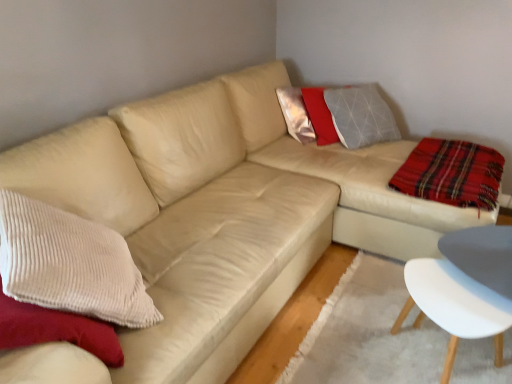
Question: Does white plastic chair at lower right have a smaller size compared to plaid fabric at right?

Choices:
 (A) yes
 (B) no

Answer: (B)

Question: Could plaid fabric at right be considered to be inside white plastic chair at lower right?

Choices:
 (A) yes
 (B) no

Answer: (B)

Question: Is white plastic chair at lower right positioned behind plaid fabric at right?

Choices:
 (A) yes
 (B) no

Answer: (B)

Question: Does white plastic chair at lower right turn towards plaid fabric at right?

Choices:
 (A) no
 (B) yes

Answer: (A)

Question: Is white plastic chair at lower right looking in the opposite direction of plaid fabric at right?

Choices:
 (A) no
 (B) yes

Answer: (A)

Question: From a real-world perspective, is white plastic chair at lower right below plaid fabric at right?

Choices:
 (A) yes
 (B) no

Answer: (A)

Question: Does plaid fabric at right have a lesser width compared to white plastic chair at lower right?

Choices:
 (A) yes
 (B) no

Answer: (B)

Question: Can you confirm if plaid fabric at right is positioned to the left of white plastic chair at lower right?

Choices:
 (A) yes
 (B) no

Answer: (B)

Question: Is plaid fabric at right touching white plastic chair at lower right?

Choices:
 (A) no
 (B) yes

Answer: (A)

Question: Does plaid fabric at right come in front of white plastic chair at lower right?

Choices:
 (A) yes
 (B) no

Answer: (B)

Question: Does plaid fabric at right come behind white plastic chair at lower right?

Choices:
 (A) no
 (B) yes

Answer: (B)

Question: Does plaid fabric at right turn towards white plastic chair at lower right?

Choices:
 (A) no
 (B) yes

Answer: (A)

Question: Is point (408, 289) positioned closer to the camera than point (481, 175)?

Choices:
 (A) closer
 (B) farther

Answer: (A)